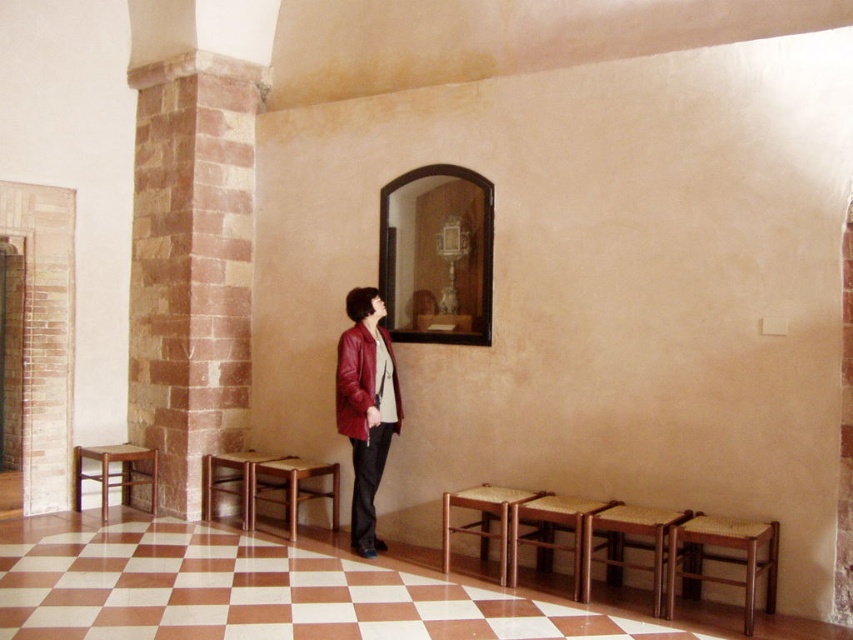
You are an interior designer assessing the layout of this room. You notice the leather jacket at center and the wooden table at lower center. Based on their positions, which object is closer to the ceiling?

The leather jacket at center is above the wooden table at lower center, so it is closer to the ceiling.

You are standing at the entrance of the room and see the point marked as point [721,557]. What object is located at that point?

The woven wood stool at lower right is located at point [721,557].

You are an interior designer analyzing the layout of this room. The room has a checkered floor with white and reddish brown squares. You need to place a new decorative item exactly where the matte red leather jacket at center is currently located. What coordinates should you mark for this placement?

The coordinates for placing the new decorative item should be at point (364,406), as that is where the matte red leather jacket at center is located.